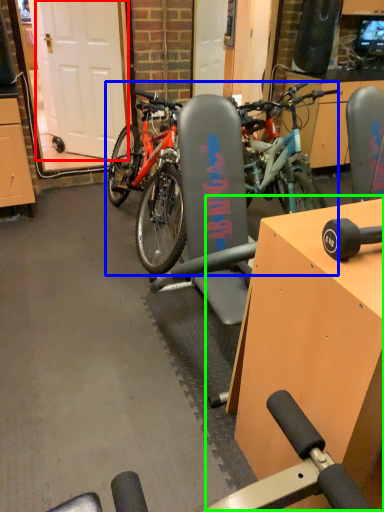
Question: Considering the real-world distances, which object is closest to garage door (highlighted by a red box)? bicycle (highlighted by a blue box) or table (highlighted by a green box).

Choices:
 (A) bicycle
 (B) table

Answer: (A)